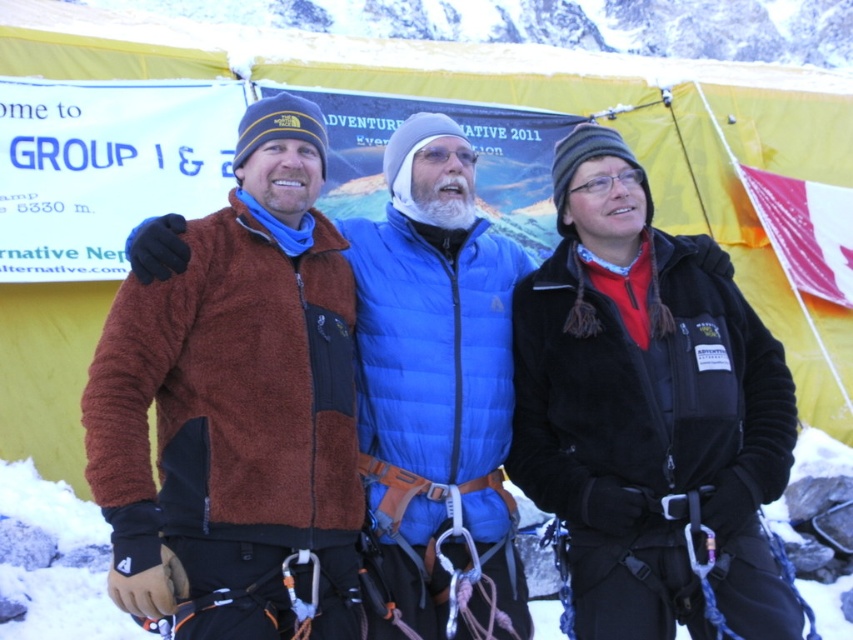
You are planning to take a photo of the two climbers wearing the brown fleece jacket at center and the black fleece jacket at center. Which one should you focus on if you want to capture the taller climber in the photo?

The brown fleece jacket at center is much taller than the black fleece jacket at center, so you should focus on the climber wearing the brown fleece jacket at center to capture the taller one.

You are a photographer planning to take a picture of the black fleece jacket at center. What are the coordinates where you should aim your camera?

The coordinates for the black fleece jacket at center are at point (650, 413).

Consider the image. You are a photographer trying to capture a group photo of the climbers. You want to arrange them so that the brown fleece jacket at center is positioned to the right of the black fleece jacket at center. Based on their current positions, is this arrangement possible without moving anyone?

The brown fleece jacket at center is currently to the left of the black fleece jacket at center. To have the brown fleece jacket at center to the right of the black fleece jacket at center, they would need to swap positions, which would require moving at least one person. Therefore, the desired arrangement is not possible without moving anyone.